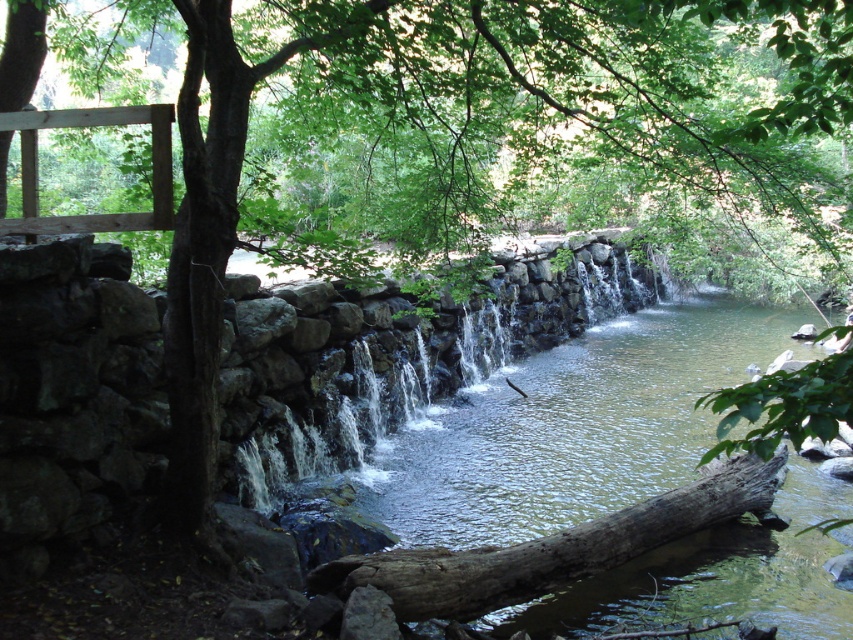
Question: Is clear stone waterfall at center below brown rough log at center?

Choices:
 (A) yes
 (B) no

Answer: (B)

Question: Is clear stone waterfall at center above brown rough log at center?

Choices:
 (A) yes
 (B) no

Answer: (A)

Question: Which of the following is the farthest from the observer?

Choices:
 (A) 445,384
 (B) 439,556

Answer: (A)

Question: Does clear stone waterfall at center appear under brown rough log at center?

Choices:
 (A) no
 (B) yes

Answer: (A)